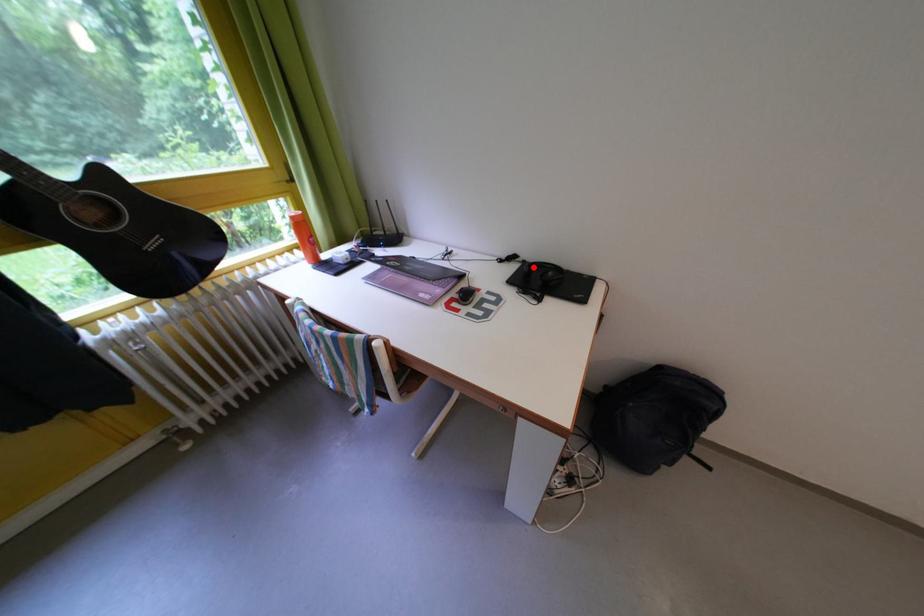
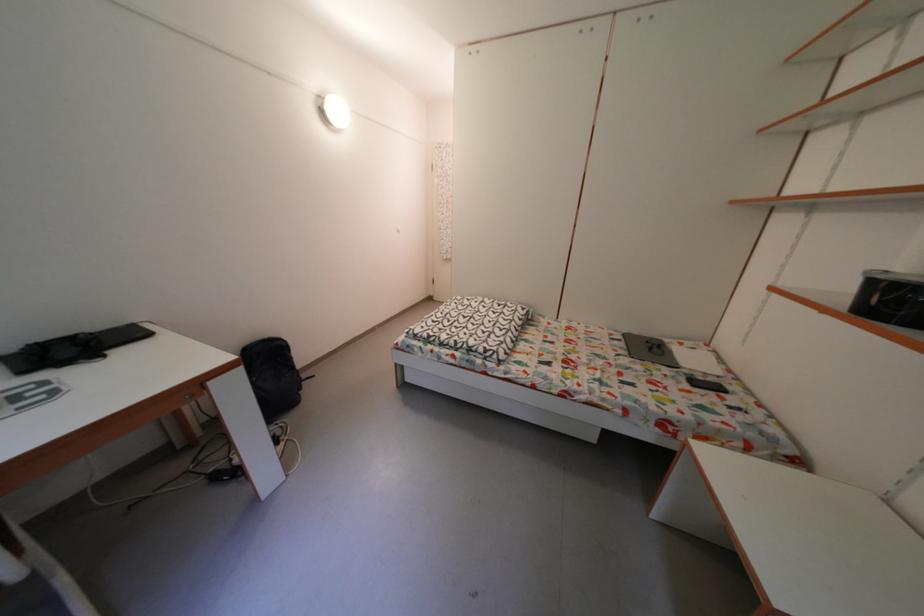
In the second image, find the point that corresponds to the highlighted location in the first image.

(6, 363)